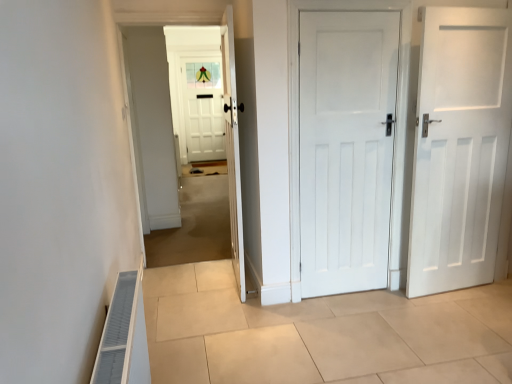
In the scene shown: In order to face white wooden door at center, should I rotate leftwards or rightwards?

Turn left by 10.177 degrees to look at white wooden door at center.

Measure the distance between point [209,283] and camera.

The distance of point [209,283] from camera is 11.25 feet.

At what (x,y) coordinates should I click in order to perform the action: click on white wooden door at center, placed as the third door when sorted from right to left. Please return your answer as a coordinate pair (x, y). The height and width of the screenshot is (384, 512). Looking at the image, I should click on (233, 148).

Based on the photo, considering the relative sizes of white wooden door at center, placed as the first door when sorted from left to right, and white wooden door at center in the image provided, is white wooden door at center, placed as the first door when sorted from left to right, bigger than white wooden door at center?

Actually, white wooden door at center, placed as the first door when sorted from left to right, might be smaller than white wooden door at center.

Which is less distant, (x=234, y=55) or (x=225, y=151)?

Point (x=234, y=55)

How many degrees apart are the facing directions of white wooden door at center, placed as the third door when sorted from right to left, and white wooden door at center?

93 degrees.

Considering the relative positions of white wooden door at center, placed as the first door when sorted from left to right, and white wooden door at center in the image provided, is white wooden door at center, placed as the first door when sorted from left to right, to the left or to the right of white wooden door at center?

white wooden door at center, placed as the first door when sorted from left to right, is positioned on white wooden door at center's right side.

Does white matte door at right, which ranks as the 3th door in left-to-right order, have a lesser width compared to beige tile floor at center?

Yes.

How different are the orientations of white matte door at right, arranged as the first door when viewed from the right, and beige tile floor at center in degrees?

There is a 18.7-degree angle between the facing directions of white matte door at right, arranged as the first door when viewed from the right, and beige tile floor at center.

Is white matte door at right, arranged as the first door when viewed from the right, outside of beige tile floor at center?

Yes, white matte door at right, arranged as the first door when viewed from the right, is located beyond the bounds of beige tile floor at center.

This screenshot has width=512, height=384. There is a beige tile floor at center. In order to click on the 2nd door above it (from the image's perspective) in this screenshot , I will do (459, 148).

Considering the positions of objects beige tile floor at center and white wooden door at center, placed as the first door when sorted from left to right, in the image provided, who is more to the right, beige tile floor at center or white wooden door at center, placed as the first door when sorted from left to right,?

From the viewer's perspective, beige tile floor at center appears more on the right side.

The image size is (512, 384). What are the coordinates of `the 3rd door positioned above the beige tile floor at center (from a real-world perspective)` in the screenshot? It's located at (233, 148).

From a real-world perspective, who is located lower, beige tile floor at center or white wooden door at center, placed as the third door when sorted from right to left?

beige tile floor at center, from a real-world perspective.

Is beige tile floor at center not within white wooden door at center, placed as the third door when sorted from right to left?

Absolutely, beige tile floor at center is external to white wooden door at center, placed as the third door when sorted from right to left.

Looking at this image, would you consider white matte door at right, arranged as the first door when viewed from the right, to be distant from white painted wood door at center, positioned as the second door in left-to-right order?

white matte door at right, arranged as the first door when viewed from the right, is near white painted wood door at center, positioned as the second door in left-to-right order, not far away.

Is white matte door at right, arranged as the first door when viewed from the right, wider or thinner than white painted wood door at center, positioned as the second door in left-to-right order?

Considering their sizes, white matte door at right, arranged as the first door when viewed from the right, looks broader than white painted wood door at center, positioned as the second door in left-to-right order.

From a real-world perspective, is white matte door at right, arranged as the first door when viewed from the right, on top of white painted wood door at center, positioned as the second door in left-to-right order?

No, from a real-world perspective, white matte door at right, arranged as the first door when viewed from the right, is not over white painted wood door at center, positioned as the second door in left-to-right order

Which is behind, white matte door at right, arranged as the first door when viewed from the right, or white painted wood door at center, the second door when ordered from right to left?

Positioned behind is white painted wood door at center, the second door when ordered from right to left.

I want to click on corridor above the white matte door at right, arranged as the first door when viewed from the right (from a real-world perspective), so click(170, 69).

From a real-world perspective, is white wooden door at center over white matte door at right, arranged as the first door when viewed from the right?

Yes, from a real-world perspective, white wooden door at center is on top of white matte door at right, arranged as the first door when viewed from the right.

Which is behind, point (150, 14) or point (473, 87)?

The point (150, 14) is farther from the camera.

Based on their positions, is white wooden door at center located to the left or right of white matte door at right, arranged as the first door when viewed from the right?

Clearly, white wooden door at center is on the left of white matte door at right, arranged as the first door when viewed from the right, in the image.

Is beige tile floor at center in front of or behind white painted wood door at center, positioned as the second door in left-to-right order, in the image?

beige tile floor at center is positioned closer to the viewer than white painted wood door at center, positioned as the second door in left-to-right order.

Is beige tile floor at center smaller than white painted wood door at center, the second door when ordered from right to left?

Incorrect, beige tile floor at center is not smaller in size than white painted wood door at center, the second door when ordered from right to left.

Does beige tile floor at center have a lesser width compared to white painted wood door at center, positioned as the second door in left-to-right order?

No, beige tile floor at center is not thinner than white painted wood door at center, positioned as the second door in left-to-right order.

Which object is positioned more to the left, beige tile floor at center or white painted wood door at center, positioned as the second door in left-to-right order?

From the viewer's perspective, white painted wood door at center, positioned as the second door in left-to-right order, appears more on the left side.

Which is correct: white wooden door at center, placed as the third door when sorted from right to left, is inside beige tile floor at center, or outside of it?

white wooden door at center, placed as the third door when sorted from right to left, exists outside the volume of beige tile floor at center.

Is white wooden door at center, placed as the third door when sorted from right to left, looking in the opposite direction of beige tile floor at center?

Correct, white wooden door at center, placed as the third door when sorted from right to left, is looking away from beige tile floor at center.

In the scene shown: Is white wooden door at center, placed as the third door when sorted from right to left, at the right side of beige tile floor at center?

In fact, white wooden door at center, placed as the third door when sorted from right to left, is to the left of beige tile floor at center.

Which of these two, white wooden door at center, placed as the first door when sorted from left to right, or beige tile floor at center, is thinner?

Thinner between the two is white wooden door at center, placed as the first door when sorted from left to right.

Locate an element on the screen. door that is the 1st object located below the white wooden door at center (from the image's perspective) is located at coordinates (233, 148).

The image size is (512, 384). What are the coordinates of `door that is on the right side of beige tile floor at center` in the screenshot? It's located at (459, 148).

Based on their spatial positions, is white wooden door at center, placed as the third door when sorted from right to left, or white painted wood door at center, the second door when ordered from right to left, further from white wooden door at center?

white painted wood door at center, the second door when ordered from right to left.

Considering their positions, is white matte door at right, which ranks as the 3th door in left-to-right order, positioned further to white painted wood door at center, the second door when ordered from right to left, than white wooden door at center, placed as the first door when sorted from left to right?

Based on the image, white wooden door at center, placed as the first door when sorted from left to right, appears to be further to white painted wood door at center, the second door when ordered from right to left.

When comparing their distances from white wooden door at center, does white painted wood door at center, the second door when ordered from right to left, or white wooden door at center, placed as the first door when sorted from left to right, seem closer?

Among the two, white wooden door at center, placed as the first door when sorted from left to right, is located nearer to white wooden door at center.

Based on their spatial positions, is white wooden door at center or beige tile floor at center closer to white wooden door at center, placed as the third door when sorted from right to left?

beige tile floor at center is positioned closer to the anchor white wooden door at center, placed as the third door when sorted from right to left.

Estimate the real-world distances between objects in this image. Which object is further from white matte door at right, which ranks as the 3th door in left-to-right order, white wooden door at center, placed as the third door when sorted from right to left, or beige tile floor at center?

The object further to white matte door at right, which ranks as the 3th door in left-to-right order, is white wooden door at center, placed as the third door when sorted from right to left.

Considering their positions, is beige tile floor at center positioned further to white wooden door at center, placed as the first door when sorted from left to right, than white matte door at right, arranged as the first door when viewed from the right?

Among the two, white matte door at right, arranged as the first door when viewed from the right, is located further to white wooden door at center, placed as the first door when sorted from left to right.

Which object lies nearer to the anchor point white wooden door at center, white wooden door at center, placed as the third door when sorted from right to left, or white matte door at right, which ranks as the 3th door in left-to-right order?

white wooden door at center, placed as the third door when sorted from right to left, is closer to white wooden door at center.

Considering their positions, is white matte door at right, arranged as the first door when viewed from the right, positioned further to white wooden door at center, placed as the third door when sorted from right to left, than white painted wood door at center, positioned as the second door in left-to-right order?

white matte door at right, arranged as the first door when viewed from the right.

I want to click on path between white wooden door at center and white matte door at right, which ranks as the 3th door in left-to-right order, from left to right, so click(x=321, y=334).

At what (x,y) coordinates should I click in order to perform the action: click on door between white wooden door at center, placed as the third door when sorted from right to left, and white matte door at right, arranged as the first door when viewed from the right, from left to right. Please return your answer as a coordinate pair (x, y). Looking at the image, I should click on point(346,148).

Locate an element on the screen. This screenshot has height=384, width=512. door between white wooden door at center and white painted wood door at center, positioned as the second door in left-to-right order is located at coordinates (233, 148).

Where is `door that lies between white matte door at right, arranged as the first door when viewed from the right, and beige tile floor at center from top to bottom`? The width and height of the screenshot is (512, 384). door that lies between white matte door at right, arranged as the first door when viewed from the right, and beige tile floor at center from top to bottom is located at coordinates (346, 148).